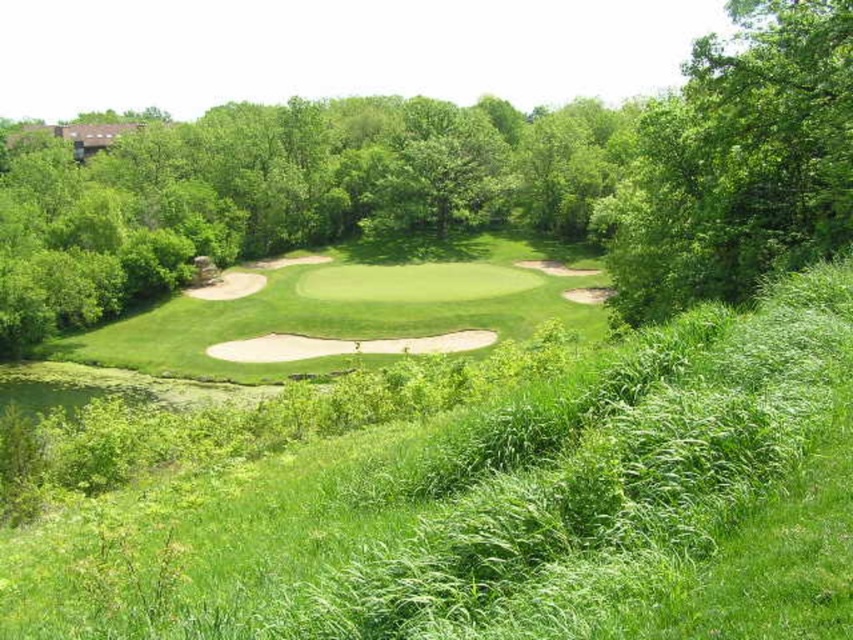
Can you confirm if green grassy golf course at center is thinner than green leafy tree at center?

Yes.

Does point (851, 492) come behind point (747, 48)?

No, (851, 492) is in front of (747, 48).

This screenshot has height=640, width=853. Find the location of `green grassy golf course at center`. green grassy golf course at center is located at coordinates (474, 497).

Can you confirm if green leafy tree at center is positioned to the right of green leafy tree at upper right?

In fact, green leafy tree at center is to the left of green leafy tree at upper right.

I want to click on green leafy tree at center, so click(x=461, y=180).

Does point (439, 369) come in front of point (798, 122)?

No, it is not.

From the picture: Is green grassy golf course at center above green leafy tree at upper right?

Actually, green grassy golf course at center is below green leafy tree at upper right.

Between point (410, 368) and point (822, 129), which one is positioned in front?

Point (822, 129)

This screenshot has height=640, width=853. In order to click on green grassy golf course at center in this screenshot , I will do click(474, 497).